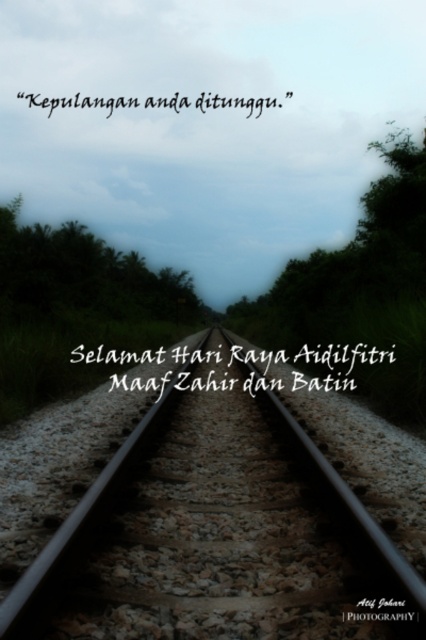
Question: Is smooth metal train track at center below black matte text at upper center?

Choices:
 (A) no
 (B) yes

Answer: (A)

Question: Which object is positioned farthest from the black matte text at upper center?

Choices:
 (A) black paper text at center
 (B) smooth metal train track at center

Answer: (A)

Question: From the image, what is the correct spatial relationship of black paper text at center in relation to black matte text at upper center?

Choices:
 (A) above
 (B) below

Answer: (A)

Question: Which object appears farthest from the camera in this image?

Choices:
 (A) black paper text at center
 (B) smooth metal train track at center

Answer: (A)

Question: Estimate the real-world distances between objects in this image. Which object is closer to the smooth metal train track at center?

Choices:
 (A) black paper text at center
 (B) black matte text at upper center
 (C) black text at center

Answer: (A)

Question: Where is smooth metal train track at center located in relation to black matte text at upper center in the image?

Choices:
 (A) left
 (B) right

Answer: (A)